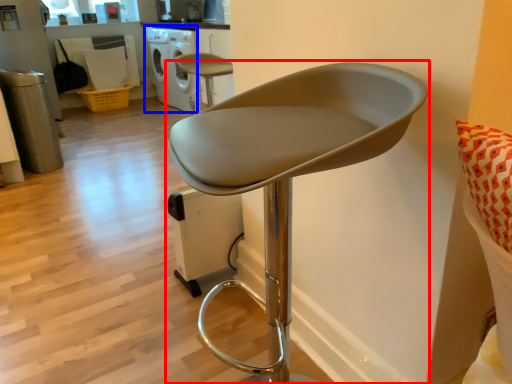
Question: Which of the following is the farthest to the observer, chair (highlighted by a red box) or dish washer (highlighted by a blue box)?

Choices:
 (A) chair
 (B) dish washer

Answer: (B)